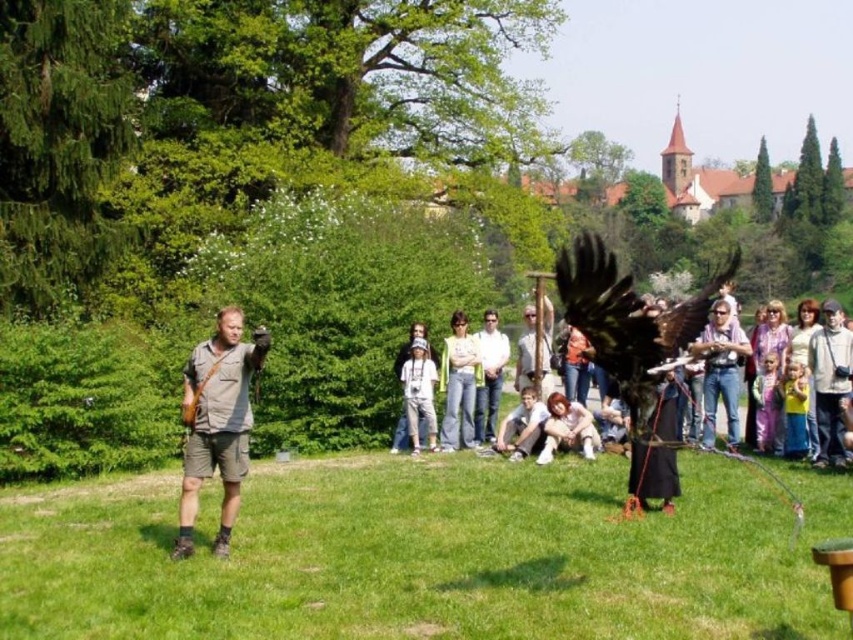
Question: Which is nearer to the brown canvas shorts at center?

Choices:
 (A) shiny black falcon at center
 (B) light gray cotton shirt at center
 (C) light brown hair at lower center
 (D) light brown denim jeans at center

Answer: (C)

Question: Does shiny black falcon at center appear on the left side of light brown denim jeans at center?

Choices:
 (A) no
 (B) yes

Answer: (A)

Question: From the image, what is the correct spatial relationship of light brown denim jeans at center in relation to light gray cotton shirt at center?

Choices:
 (A) above
 (B) below

Answer: (A)

Question: Which object is closer to the camera taking this photo?

Choices:
 (A) light brown denim jeans at center
 (B) light brown hair at lower center

Answer: (B)

Question: Is light gray cotton shirt at center to the right of light brown hair at lower center from the viewer's perspective?

Choices:
 (A) yes
 (B) no

Answer: (B)

Question: Which of the following is the farthest from the observer?

Choices:
 (A) (558, 289)
 (B) (468, 360)

Answer: (B)